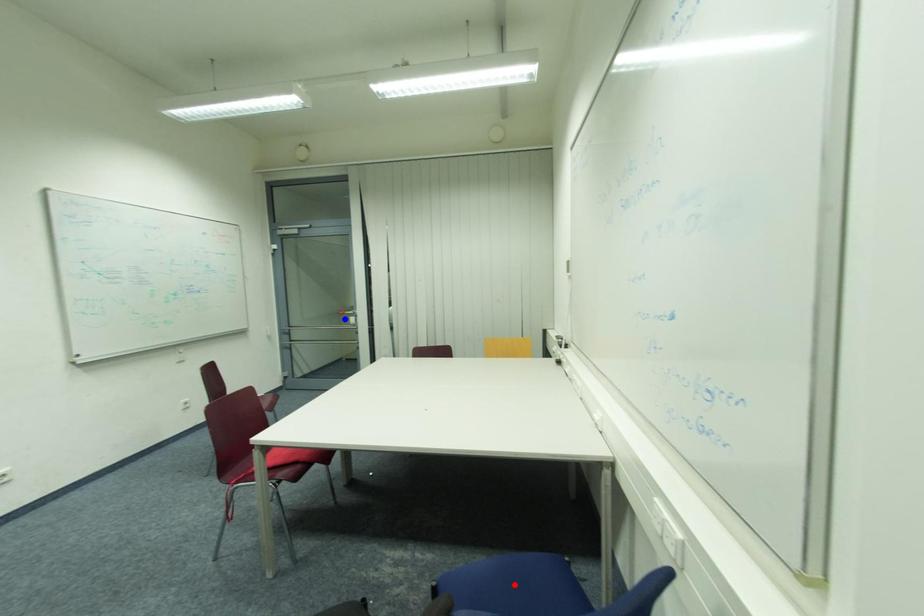
Question: Which of the two points in the image is closer to the camera?

Choices:
 (A) Blue point is closer.
 (B) Red point is closer.

Answer: (B)